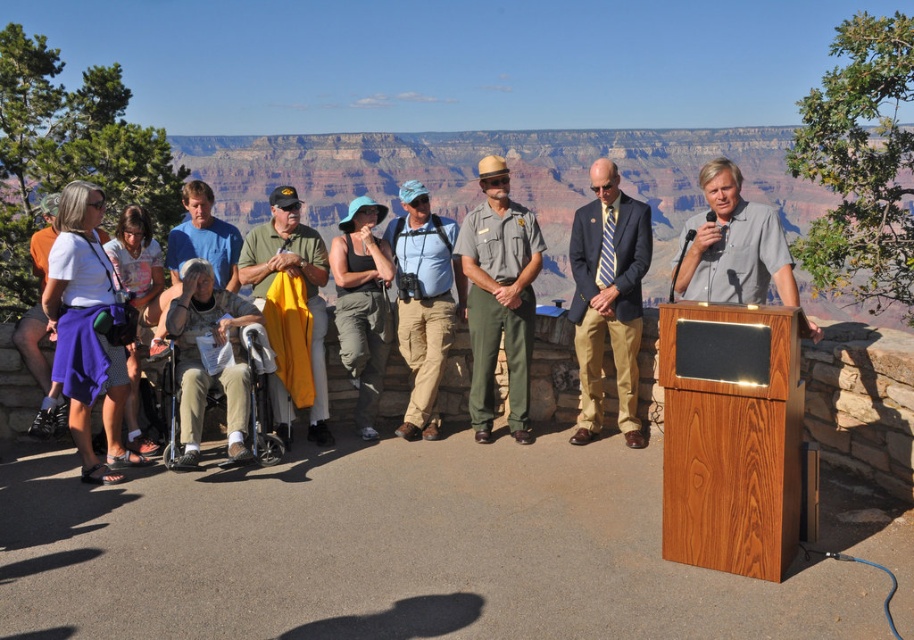
You are trying to determine the clothing items worn by the man at the podium. Which clothing item has a smaller width between the khaki cotton pants at center and the blue cotton shirt at center?

The khaki cotton pants at center has a smaller width than the blue cotton shirt at center according to the description.

You are standing at the viewpoint overlooking the Grand Canyon and want to take a photo of the green fabric jacket at center and the khaki cotton pants at center. If your camera can focus on objects up to 3 meters away, will both items be in focus?

The green fabric jacket at center is 3.47 meters away from khaki cotton pants at center. Since the camera can focus up to 3 meters, the distance between them exceeds the camera range, so both items might not be in focus simultaneously.